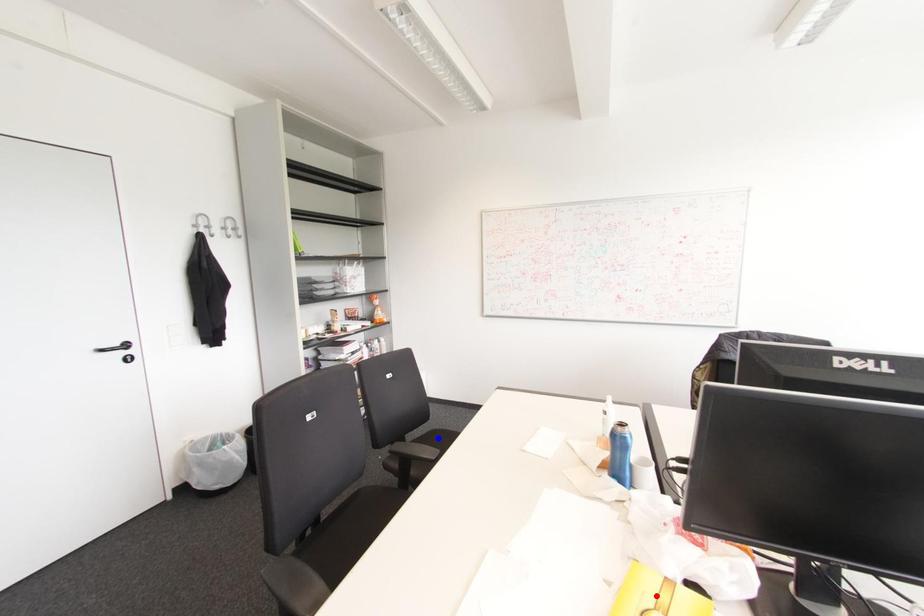
Question: Which of the two points in the image is closer to the camera?

Choices:
 (A) Blue point is closer.
 (B) Red point is closer.

Answer: (B)